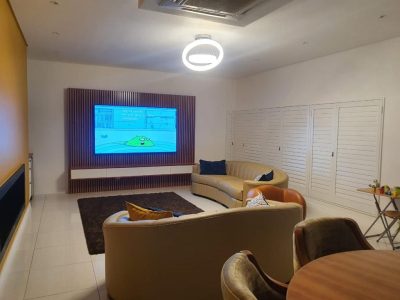
Where is `wall`? wall is located at coordinates (317, 80).